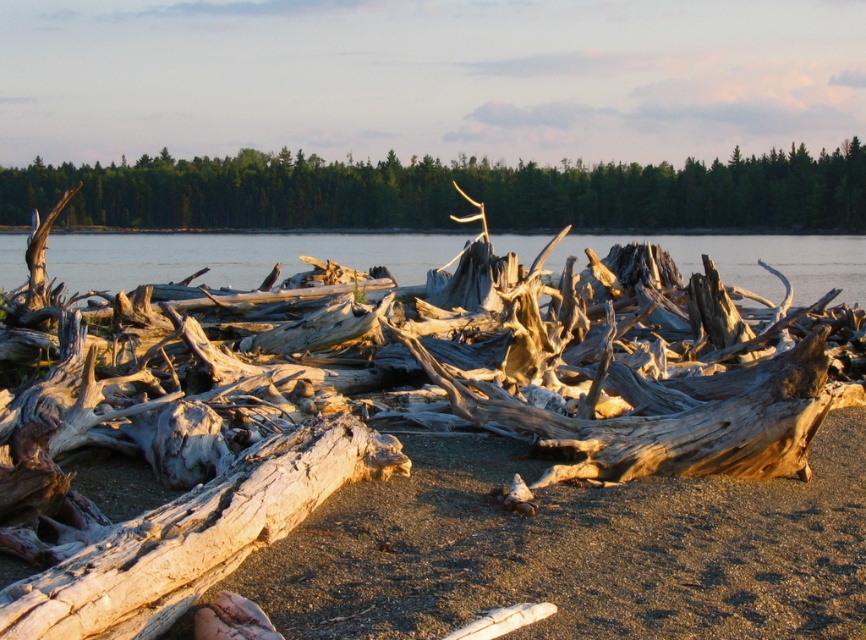
Is light brown wood at center to the left of clear water at center from the viewer's perspective?

Yes, light brown wood at center is to the left of clear water at center.

Does point (89, 630) come farther from viewer compared to point (5, 285)?

No, (89, 630) is closer to viewer.

Image resolution: width=866 pixels, height=640 pixels. Identify the location of light brown wood at center. (195, 536).

Can you confirm if smooth bark tree trunk at upper center is thinner than clear water at center?

In fact, smooth bark tree trunk at upper center might be wider than clear water at center.

Who is lower down, smooth bark tree trunk at upper center or clear water at center?

clear water at center is below.

Which is in front, point (218, 188) or point (225, 253)?

Point (225, 253) is more forward.

At what (x,y) coordinates should I click in order to perform the action: click on smooth bark tree trunk at upper center. Please return your answer as a coordinate pair (x, y). The image size is (866, 640). Looking at the image, I should click on (450, 193).

Is smooth bark tree trunk at upper center below light brown wood at center?

No, smooth bark tree trunk at upper center is not below light brown wood at center.

Which is more to the left, smooth bark tree trunk at upper center or light brown wood at center?

From the viewer's perspective, smooth bark tree trunk at upper center appears more on the left side.

Which is in front, point (393, 204) or point (145, 621)?

Positioned in front is point (145, 621).

Where is `smooth bark tree trunk at upper center`? Image resolution: width=866 pixels, height=640 pixels. smooth bark tree trunk at upper center is located at coordinates (450, 193).